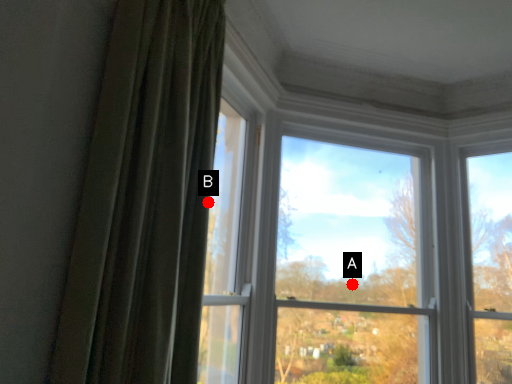
Question: Two points are circled on the image, labeled by A and B beside each circle. Which point appears farthest from the camera in this image?

Choices:
 (A) A is further
 (B) B is further

Answer: (A)